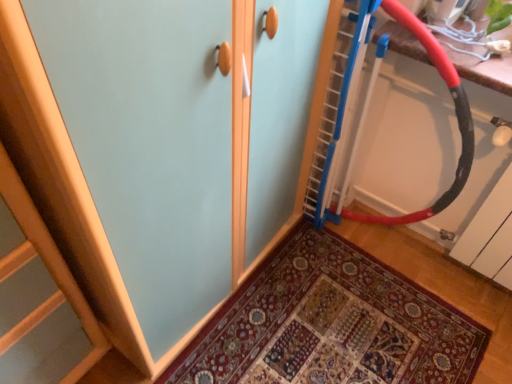
Image resolution: width=512 pixels, height=384 pixels. What do you see at coordinates (455, 112) in the screenshot? I see `red rubber battle rope at upper right` at bounding box center [455, 112].

In order to face red rubber battle rope at upper right, should I rotate leftwards or rightwards?

Turn right approximately 17.542 degrees to face it.

This screenshot has width=512, height=384. In order to click on red rubber battle rope at upper right in this screenshot , I will do `click(455, 112)`.

Locate an element on the screen. The width and height of the screenshot is (512, 384). wooden door at center is located at coordinates (331, 324).

This screenshot has width=512, height=384. What do you see at coordinates (331, 324) in the screenshot?
I see `wooden door at center` at bounding box center [331, 324].

Where is `red rubber battle rope at upper right`? This screenshot has height=384, width=512. red rubber battle rope at upper right is located at coordinates (455, 112).

Considering the relative positions of red rubber battle rope at upper right and wooden door at center in the image provided, is red rubber battle rope at upper right to the left or to the right of wooden door at center?

red rubber battle rope at upper right is to the right of wooden door at center.

Which is in front, red rubber battle rope at upper right or wooden door at center?

red rubber battle rope at upper right.

Which is behind, point (402, 216) or point (353, 300)?

The point (402, 216) is more distant.

From the image's perspective, which is below, red rubber battle rope at upper right or wooden door at center?

From the image's view, wooden door at center is below.

From a real-world perspective, does red rubber battle rope at upper right sit lower than wooden door at center?

No, from a real-world perspective, red rubber battle rope at upper right is not below wooden door at center.

Can you confirm if red rubber battle rope at upper right is thinner than wooden door at center?

Yes, red rubber battle rope at upper right is thinner than wooden door at center.

Considering the relative sizes of red rubber battle rope at upper right and wooden door at center in the image provided, is red rubber battle rope at upper right taller than wooden door at center?

Correct, red rubber battle rope at upper right is much taller as wooden door at center.

In terms of size, does red rubber battle rope at upper right appear bigger or smaller than wooden door at center?

red rubber battle rope at upper right is bigger than wooden door at center.

Would you say red rubber battle rope at upper right is outside wooden door at center?

Indeed, red rubber battle rope at upper right is completely outside wooden door at center.

Is red rubber battle rope at upper right in contact with wooden door at center?

There is a gap between red rubber battle rope at upper right and wooden door at center.

Consider the image. Is red rubber battle rope at upper right aimed at wooden door at center?

Yes, red rubber battle rope at upper right is aimed at wooden door at center.

Can you tell me how much red rubber battle rope at upper right and wooden door at center differ in facing direction?

93.8 degrees.

Where is `door beneath the red rubber battle rope at upper right (from a real-world perspective)`? Image resolution: width=512 pixels, height=384 pixels. door beneath the red rubber battle rope at upper right (from a real-world perspective) is located at coordinates (331, 324).

Based on the photo, considering the positions of objects wooden door at center and red rubber battle rope at upper right in the image provided, who is more to the left, wooden door at center or red rubber battle rope at upper right?

wooden door at center is more to the left.

Which is behind, wooden door at center or red rubber battle rope at upper right?

wooden door at center is further from the camera.

Which is behind, point (293, 353) or point (420, 26)?

The point (293, 353) is more distant.

From the image's perspective, is wooden door at center located beneath red rubber battle rope at upper right?

Yes, from the image's perspective, wooden door at center is beneath red rubber battle rope at upper right.

From a real-world perspective, is wooden door at center positioned over red rubber battle rope at upper right based on gravity?

No, from a real-world perspective, wooden door at center is not over red rubber battle rope at upper right

Looking at their sizes, would you say wooden door at center is wider or thinner than red rubber battle rope at upper right?

Clearly, wooden door at center has more width compared to red rubber battle rope at upper right.

Can you confirm if wooden door at center is shorter than red rubber battle rope at upper right?

Correct, wooden door at center is not as tall as red rubber battle rope at upper right.

From the picture: Considering the relative sizes of wooden door at center and red rubber battle rope at upper right in the image provided, is wooden door at center bigger than red rubber battle rope at upper right?

No, wooden door at center is not bigger than red rubber battle rope at upper right.

Is red rubber battle rope at upper right a part of wooden door at center?

No, red rubber battle rope at upper right is not inside wooden door at center.

Are wooden door at center and red rubber battle rope at upper right making contact?

No, wooden door at center is not next to red rubber battle rope at upper right.

Could you tell me if wooden door at center is facing red rubber battle rope at upper right?

No, wooden door at center is not aimed at red rubber battle rope at upper right.

What's the angular difference between wooden door at center and red rubber battle rope at upper right's facing directions?

wooden door at center and red rubber battle rope at upper right are facing 93.8 degrees away from each other.

Image resolution: width=512 pixels, height=384 pixels. I want to click on door below the red rubber battle rope at upper right (from the image's perspective), so click(331, 324).

Where is `battle rope lying in front of the wooden door at center`? battle rope lying in front of the wooden door at center is located at coordinates (455, 112).

This screenshot has height=384, width=512. Find the location of `door beneath the red rubber battle rope at upper right (from a real-world perspective)`. door beneath the red rubber battle rope at upper right (from a real-world perspective) is located at coordinates (331, 324).